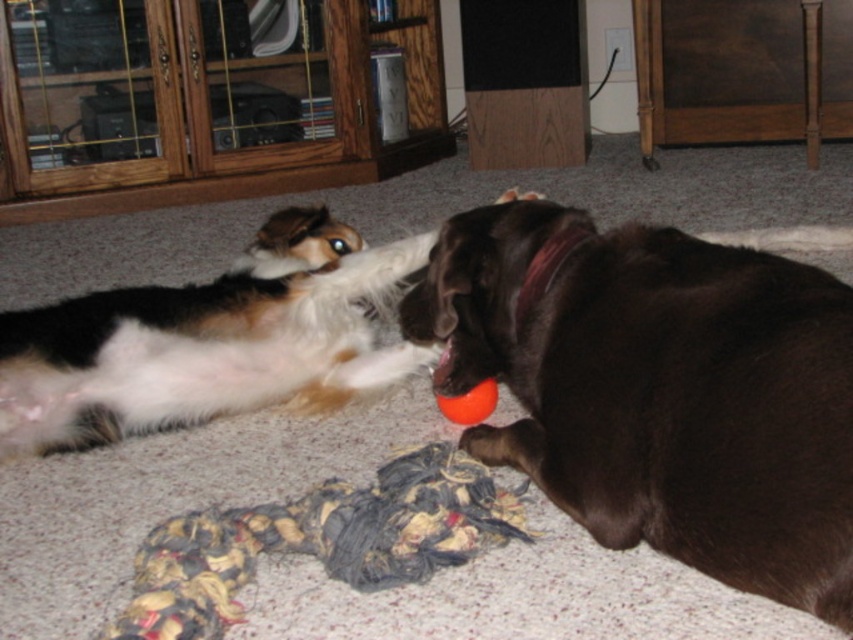
Question: Does white fur dog at upper left appear on the right side of rubber ball at lower center?

Choices:
 (A) no
 (B) yes

Answer: (A)

Question: Is shiny brown dog at lower right further to camera compared to orange rubber ball at center?

Choices:
 (A) yes
 (B) no

Answer: (B)

Question: Which point is closer to the camera?

Choices:
 (A) (467, 426)
 (B) (310, 276)
 (C) (616, 403)

Answer: (C)

Question: Can you confirm if shiny brown dog at lower right is bigger than orange rubber ball at center?

Choices:
 (A) yes
 (B) no

Answer: (A)

Question: Which object appears farthest from the camera in this image?

Choices:
 (A) shiny brown dog at lower right
 (B) orange rubber ball at center

Answer: (B)

Question: Considering the real-world distances, which object is closest to the orange rubber ball at center?

Choices:
 (A) rubber ball at lower center
 (B) white fur dog at upper left
 (C) shiny brown dog at lower right

Answer: (A)